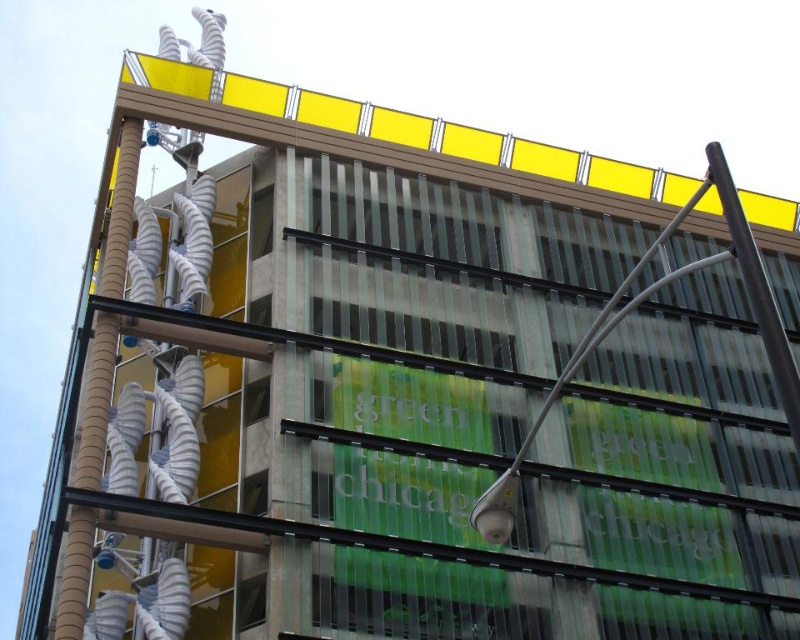
Looking at this image, you are a maintenance worker needing to reach the brown corrugated pipe at left and the black metal pole at upper right. The maintenance ladder you have can extend up to 30 meters. Can you safely reach both objects with your ladder?

The brown corrugated pipe at left is 32.49 meters from the black metal pole at upper right. Since the ladder can only extend up to 30 meters, it is not long enough to safely reach both objects.

You are an architect analyzing the building design. The brown corrugated pipe at left and the black metal pole at upper right are part of the building structure. Which one has a smaller diameter?

The brown corrugated pipe at left is thinner than the black metal pole at upper right, so the brown corrugated pipe at left has a smaller diameter.

You are standing in front of the modern building and want to touch the brown corrugated pipe at left and the black metal pole at upper right. Which object will you reach first?

The brown corrugated pipe at left is closer to you than the black metal pole at upper right, so you will reach the brown corrugated pipe at left first.